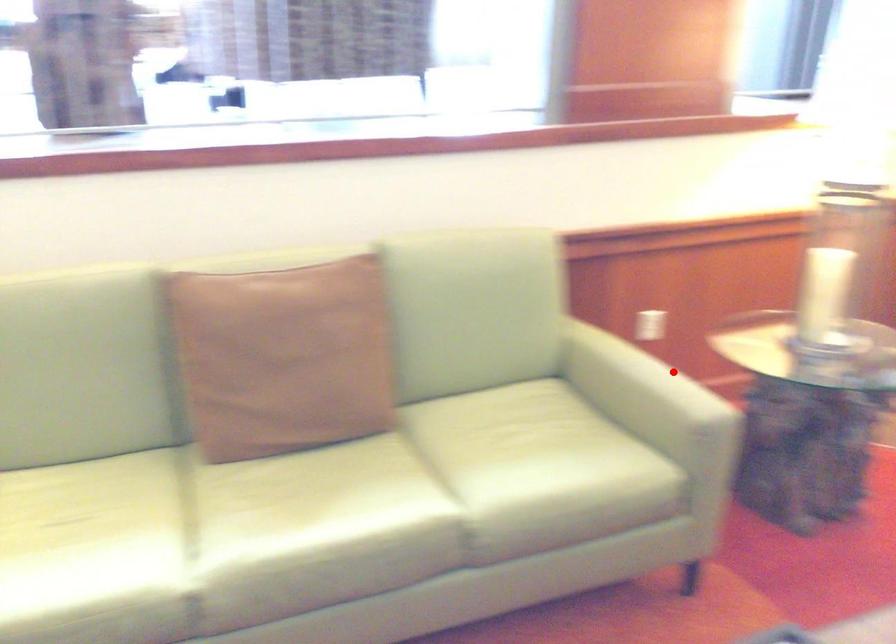
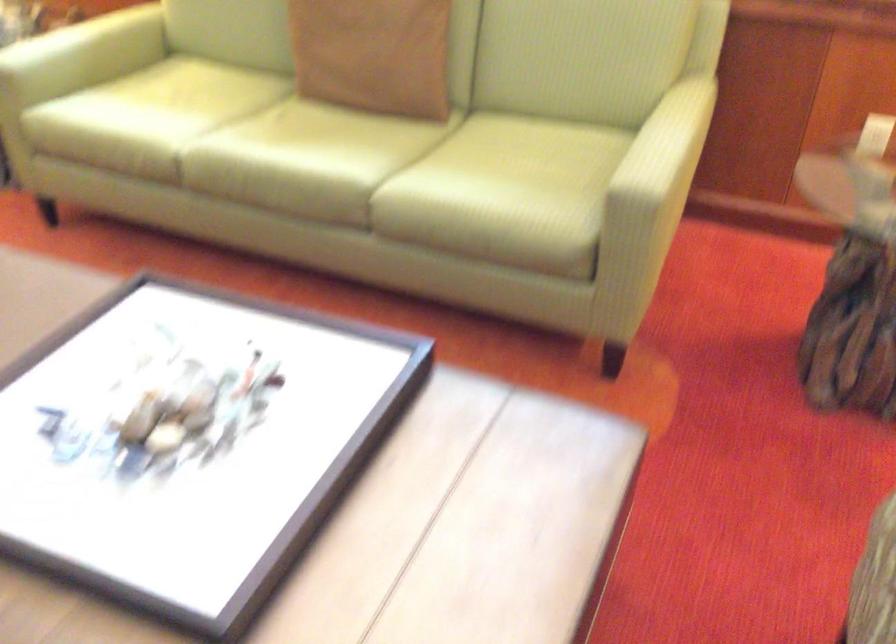
Question: I am providing you with two images of the same scene from different viewpoints. In image1, a red point is highlighted. Considering the same 3D point in image2, which of the following is correct?

Choices:
 (A) It is closer
 (B) It is farther

Answer: (A)